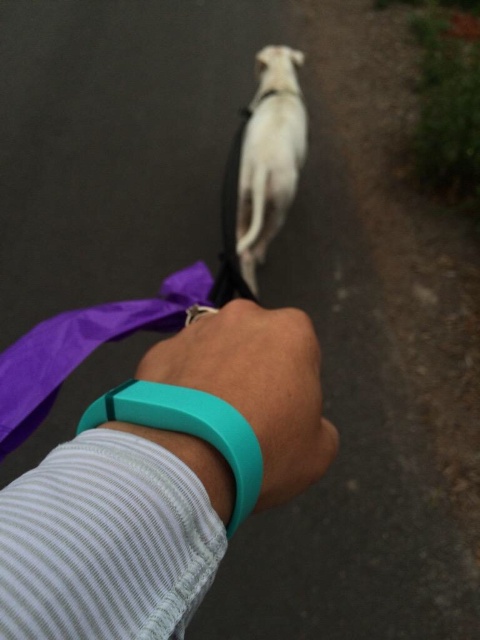
Which is behind, point (225, 404) or point (248, 116)?

The point (248, 116) is behind.

Does teal rubber band at lower center have a greater width compared to purple fabric leash at center?

Indeed, teal rubber band at lower center has a greater width compared to purple fabric leash at center.

The width and height of the screenshot is (480, 640). Identify the location of teal rubber band at lower center. (189, 429).

This screenshot has width=480, height=640. In order to click on teal rubber band at lower center in this screenshot , I will do `click(189, 429)`.

Between white fur dog at center and purple fabric leash at center, which one is positioned lower?

purple fabric leash at center is below.

Does white fur dog at center come behind purple fabric leash at center?

Yes, it is.

Which is behind, point (291, 161) or point (227, 296)?

Positioned behind is point (291, 161).

Identify the location of white fur dog at center. The image size is (480, 640). (269, 156).

Does teal rubber band at center have a larger size compared to white fur dog at center?

No.

Measure the distance between point (271, 390) and camera.

Point (271, 390) is 15.37 inches away from camera.

Where is `teal rubber band at center`? The image size is (480, 640). teal rubber band at center is located at coordinates (257, 385).